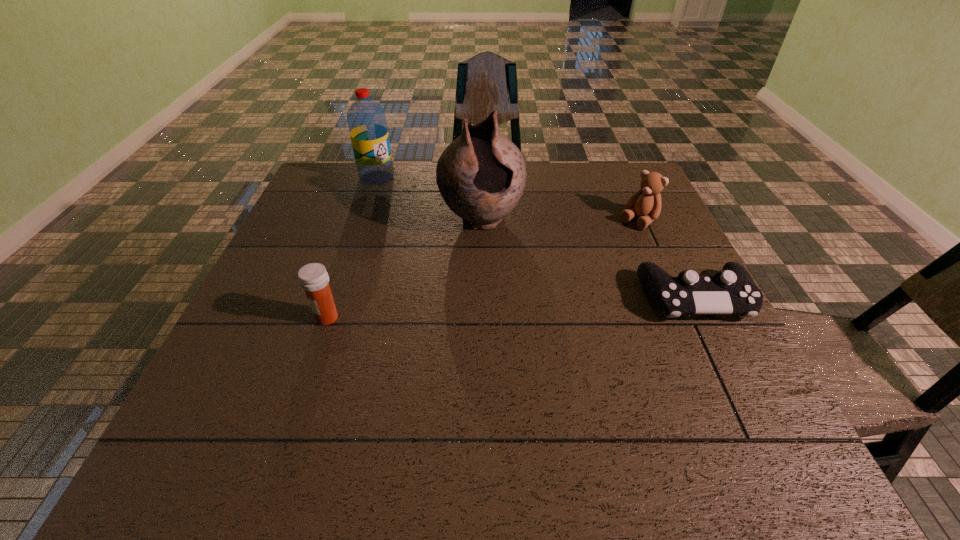
Where is `medicine`? The image size is (960, 540). medicine is located at coordinates (313, 278).

Where is `the shortest object`? This screenshot has height=540, width=960. the shortest object is located at coordinates (731, 290).

Where is `teddy bear`? teddy bear is located at coordinates (646, 203).

The width and height of the screenshot is (960, 540). Find the location of `the third object from left to right`. the third object from left to right is located at coordinates (481, 175).

Find the location of `the farthest object`. the farthest object is located at coordinates (366, 119).

This screenshot has width=960, height=540. I want to click on the second tallest object, so click(366, 119).

What are the coordinates of `vacant point located on the label side of the medicine` in the screenshot? It's located at (246, 318).

This screenshot has width=960, height=540. What are the coordinates of `free location located on the label side of the medicine` in the screenshot? It's located at (274, 318).

Locate an element on the screen. vacant space located 0.060m on the label side of the medicine is located at coordinates (287, 318).

The image size is (960, 540). Find the location of `vacant space located 0.070m on the surface of the control`. vacant space located 0.070m on the surface of the control is located at coordinates (722, 352).